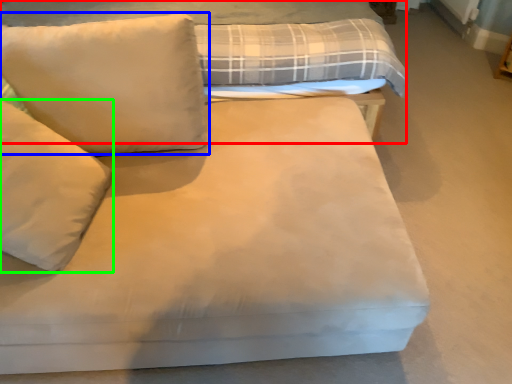
Question: Estimate the real-world distances between objects in this image. Which object is farther from bed (highlighted by a red box), pillow (highlighted by a blue box) or pillow (highlighted by a green box)?

Choices:
 (A) pillow
 (B) pillow

Answer: (B)